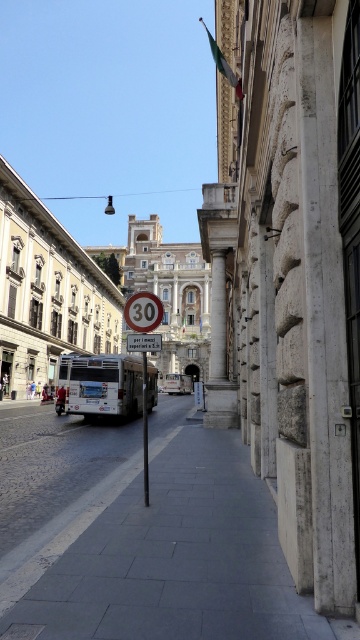
Who is lower down, white matte bus at center or metallic circular speed limit sign at center?

white matte bus at center

Does point (146, 401) come closer to viewer compared to point (138, 300)?

No, (146, 401) is further to viewer.

What are the coordinates of `white matte bus at center` in the screenshot? It's located at (101, 385).

In order to click on white matte bus at center in this screenshot , I will do `click(101, 385)`.

Can you confirm if white matte bus at center is positioned below white plastic speed limit sign at upper center?

Indeed, white matte bus at center is positioned under white plastic speed limit sign at upper center.

Can you confirm if white matte bus at center is positioned to the left of white plastic speed limit sign at upper center?

Correct, you'll find white matte bus at center to the left of white plastic speed limit sign at upper center.

Which is in front, point (122, 404) or point (156, 340)?

Point (156, 340) is more forward.

Identify the location of white matte bus at center. This screenshot has height=640, width=360. (101, 385).

Is metallic circular speed limit sign at center taller than white plastic speed limit sign at upper center?

Yes.

Is metallic circular speed limit sign at center behind white plastic speed limit sign at upper center?

Yes, it is behind white plastic speed limit sign at upper center.

Which is in front, point (156, 320) or point (133, 348)?

Point (156, 320) is in front.

You are a GUI agent. You are given a task and a screenshot of the screen. Output one action in this format:
    pyautogui.click(x=<x>, y=<y>)
    Task: Click on the metallic circular speed limit sign at center
    
    Given the screenshot: What is the action you would take?
    pyautogui.click(x=142, y=310)